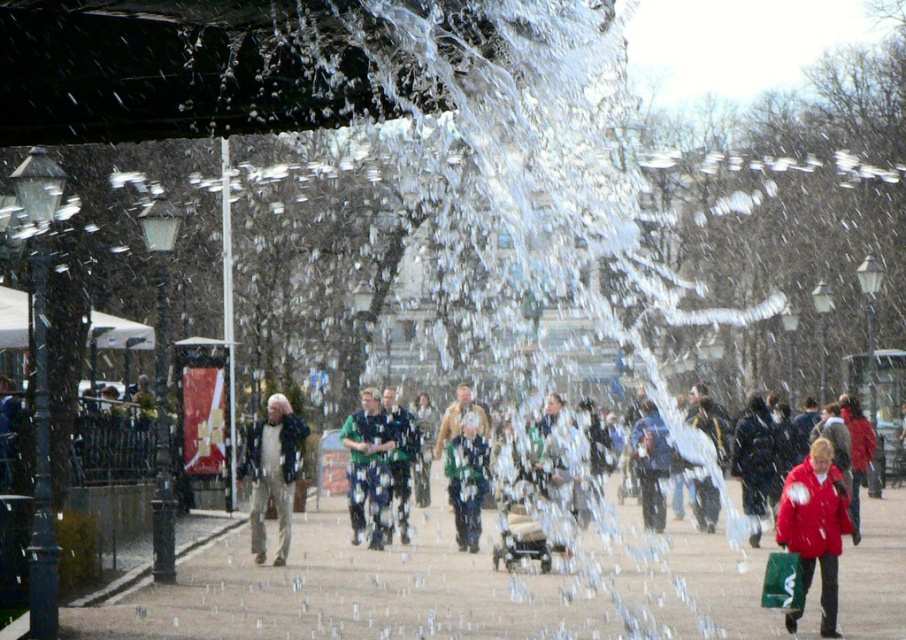
You are standing in the snowy square and want to walk from the fountain to the lampposts in the background. Which point, point (795, 621) or point (400, 468), is closer to you as you start walking towards the lampposts?

Point (795, 621) is closer to the viewer than point (400, 468), so you would reach point (795, 621) first as you walk towards the lampposts.

You are standing at the center of the square and want to find the matte red coat at lower right. Which direction should you move to reach it?

You should move towards the lower right direction to reach the matte red coat at lower right since it is located at point [815,524].

You are standing in the snowy park and see the fountain in the distance and the matte red coat at lower right. If you want to reach the coat quickly, should you walk towards the fountain first or directly towards the coat?

You should walk directly towards the matte red coat at lower right because it is only 13.93 meters away from you, so going straight to it is faster than going via the fountain.